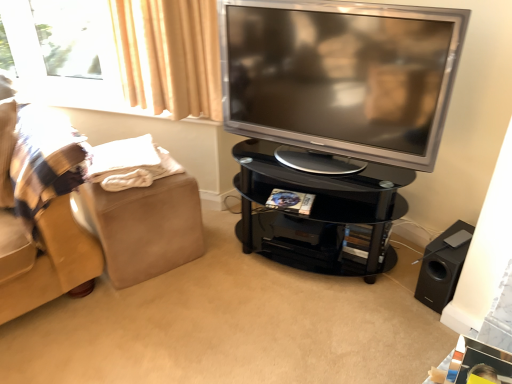
The height and width of the screenshot is (384, 512). Find the location of `vacant area that is situated to the right of beige fabric footrest at left`. vacant area that is situated to the right of beige fabric footrest at left is located at coordinates (221, 257).